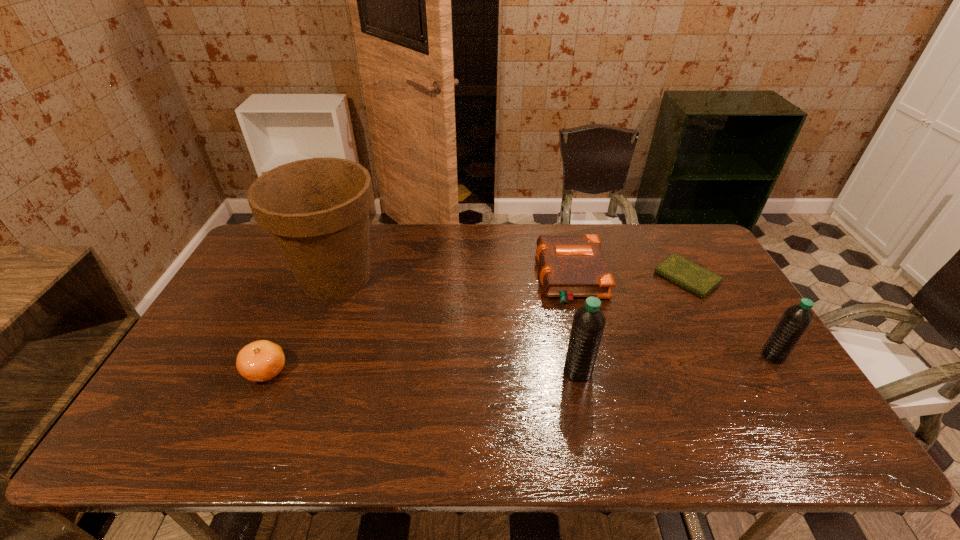
Considering the uniform spacing of water bottles, where should an additional water bottle be positioned on the left? Please locate a free spot. Please provide its 2D coordinates. Your answer should be formatted as a tuple, i.e. [(x, y)], where the tuple contains the x and y coordinates of a point satisfying the conditions above.

[(370, 388)]